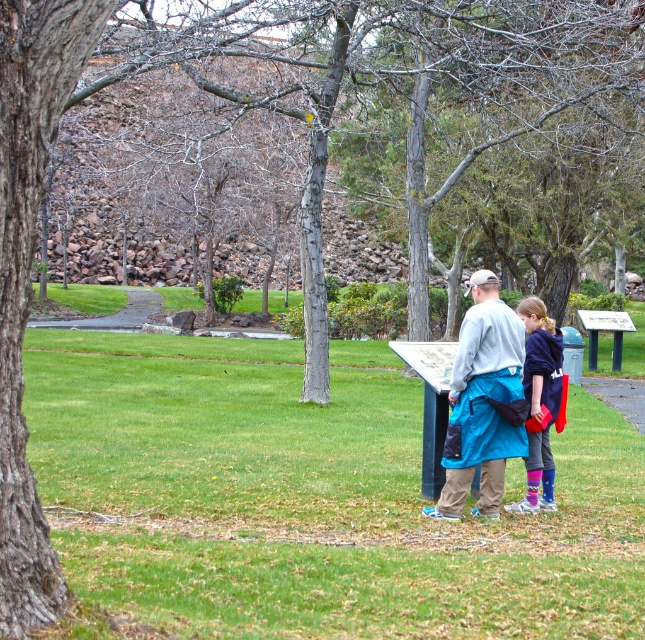
You are a photographer trying to capture both the blue fabric jacket at center and the blue denim jacket at center in a single shot. Since both are at the center, which jacket will appear larger in your photo?

The blue fabric jacket at center will appear larger in the photo because it is closer to the viewer than the blue denim jacket at center.

You are a photographer wanting to capture both the blue fabric jacket at center and the blue denim jacket at center in the same frame. Since you want to emphasize the size difference between them, which jacket should you position closer to the camera?

The blue fabric jacket at center is larger in size compared to the blue denim jacket at center. To emphasize their size difference, position the smaller blue denim jacket at center closer to the camera so that it appears larger in the frame, balancing its actual size with proximity.